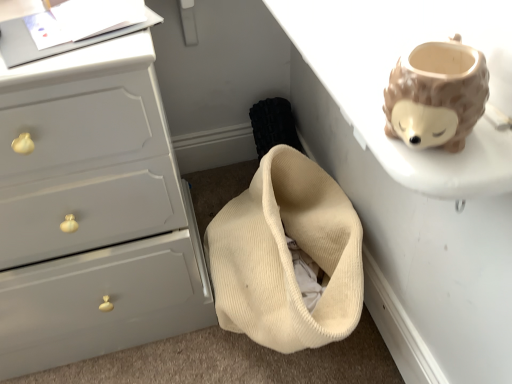
This screenshot has height=384, width=512. I want to click on white matte table at upper right, so click(413, 181).

Describe the element at coordinates (413, 181) in the screenshot. I see `white matte table at upper right` at that location.

Where is `matte gray chest of drawers at left`? matte gray chest of drawers at left is located at coordinates (93, 211).

Describe the element at coordinates (93, 211) in the screenshot. I see `matte gray chest of drawers at left` at that location.

Locate an element on the screen. This screenshot has width=512, height=384. white matte table at upper right is located at coordinates (413, 181).

In the image, is matte gray chest of drawers at left on the left side or the right side of white matte table at upper right?

From the image, it's evident that matte gray chest of drawers at left is to the left of white matte table at upper right.

Which object is closer to the camera, matte gray chest of drawers at left or white matte table at upper right?

white matte table at upper right.

Which is less distant, [31,288] or [404,34]?

The point [404,34] is more forward.

From the image's perspective, which is above, matte gray chest of drawers at left or white matte table at upper right?

white matte table at upper right.

From a real-world perspective, relative to white matte table at upper right, is matte gray chest of drawers at left vertically above or below?

matte gray chest of drawers at left is situated lower than white matte table at upper right in the real world.

Which object is thinner, matte gray chest of drawers at left or white matte table at upper right?

Thinner between the two is matte gray chest of drawers at left.

Is matte gray chest of drawers at left taller or shorter than white matte table at upper right?

Clearly, matte gray chest of drawers at left is taller compared to white matte table at upper right.

Considering the sizes of matte gray chest of drawers at left and white matte table at upper right in the image, is matte gray chest of drawers at left bigger or smaller than white matte table at upper right?

Considering their sizes, matte gray chest of drawers at left takes up more space than white matte table at upper right.

Is matte gray chest of drawers at left situated inside white matte table at upper right or outside?

matte gray chest of drawers at left lies outside white matte table at upper right.

Are matte gray chest of drawers at left and white matte table at upper right beside each other?

There is a gap between matte gray chest of drawers at left and white matte table at upper right.

Looking at this image, is matte gray chest of drawers at left oriented away from white matte table at upper right?

No.

How different are the orientations of matte gray chest of drawers at left and white matte table at upper right in degrees?

There is a 0.815-degree angle between the facing directions of matte gray chest of drawers at left and white matte table at upper right.

The width and height of the screenshot is (512, 384). There is a matte gray chest of drawers at left. What are the coordinates of `table above it (from a real-world perspective)` in the screenshot? It's located at point(413,181).

Visually, is white matte table at upper right positioned to the left or to the right of matte gray chest of drawers at left?

Clearly, white matte table at upper right is on the right of matte gray chest of drawers at left in the image.

Is white matte table at upper right closer to the viewer compared to matte gray chest of drawers at left?

Yes, white matte table at upper right is closer to the viewer.

Which is farther, [325,160] or [156,267]?

The point [325,160] is farther.

From the image's perspective, which is above, white matte table at upper right or matte gray chest of drawers at left?

white matte table at upper right appears higher in the image.

From a real-world perspective, is white matte table at upper right located higher than matte gray chest of drawers at left?

Yes, from a real-world perspective, white matte table at upper right is on top of matte gray chest of drawers at left.

Which of these two, white matte table at upper right or matte gray chest of drawers at left, is wider?

white matte table at upper right is wider.

From their relative heights in the image, would you say white matte table at upper right is taller or shorter than matte gray chest of drawers at left?

white matte table at upper right is shorter than matte gray chest of drawers at left.

Can you confirm if white matte table at upper right is smaller than matte gray chest of drawers at left?

Yes, white matte table at upper right is smaller than matte gray chest of drawers at left.

Is white matte table at upper right spatially inside matte gray chest of drawers at left, or outside of it?

white matte table at upper right cannot be found inside matte gray chest of drawers at left.

Are white matte table at upper right and matte gray chest of drawers at left located far from each other?

No, there isn't a large distance between white matte table at upper right and matte gray chest of drawers at left.

Is white matte table at upper right oriented away from matte gray chest of drawers at left?

No, white matte table at upper right is not facing the opposite direction of matte gray chest of drawers at left.

Measure the distance from white matte table at upper right to matte gray chest of drawers at left.

white matte table at upper right and matte gray chest of drawers at left are 18.76 inches apart from each other.

The image size is (512, 384). In order to click on the chest of drawers lying below the white matte table at upper right (from the image's perspective) in this screenshot , I will do `click(93, 211)`.

This screenshot has width=512, height=384. I want to click on chest of drawers on the left of white matte table at upper right, so (x=93, y=211).

Locate an element on the screen. The image size is (512, 384). table located on the right of matte gray chest of drawers at left is located at coordinates (413, 181).